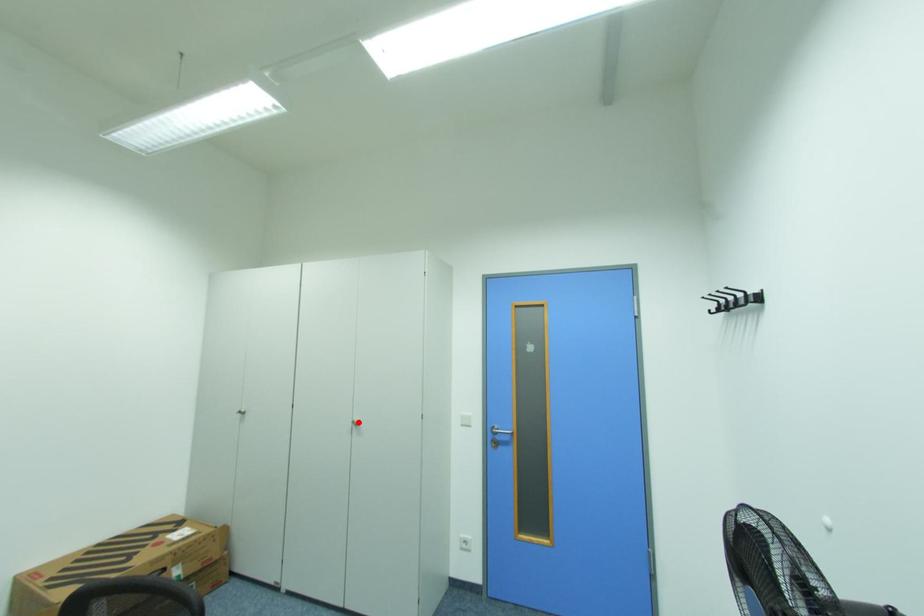
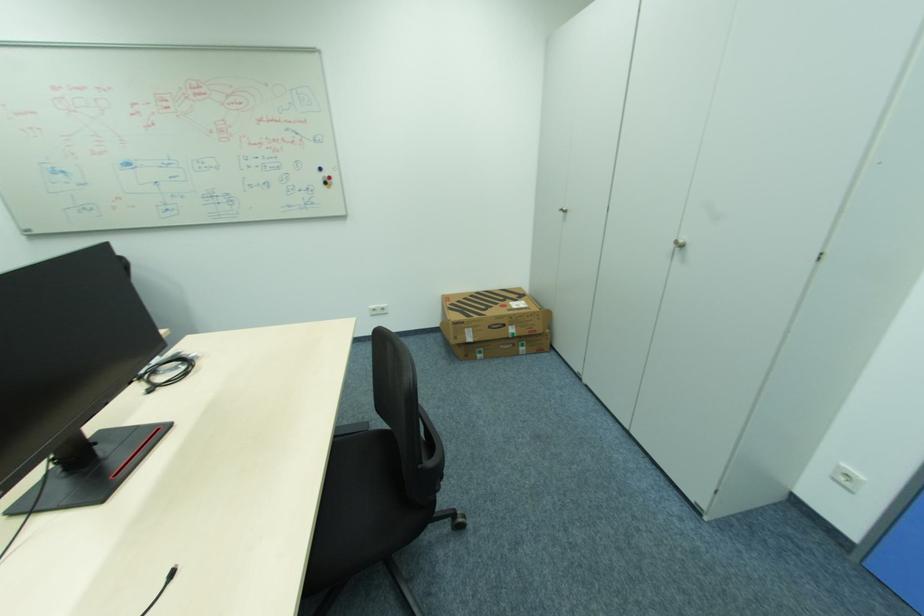
Locate, in the second image, the point that corresponds to the highlighted location in the first image.

(679, 243)